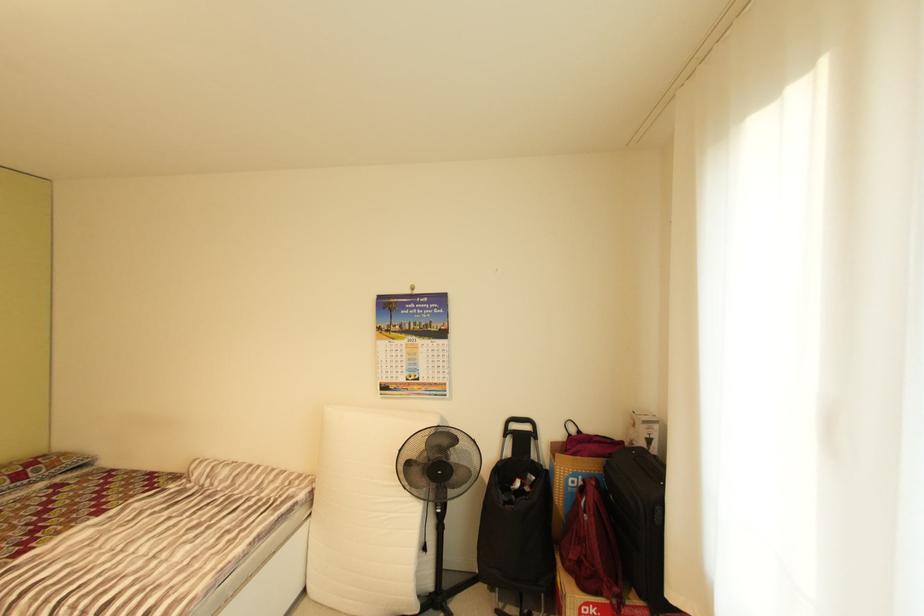
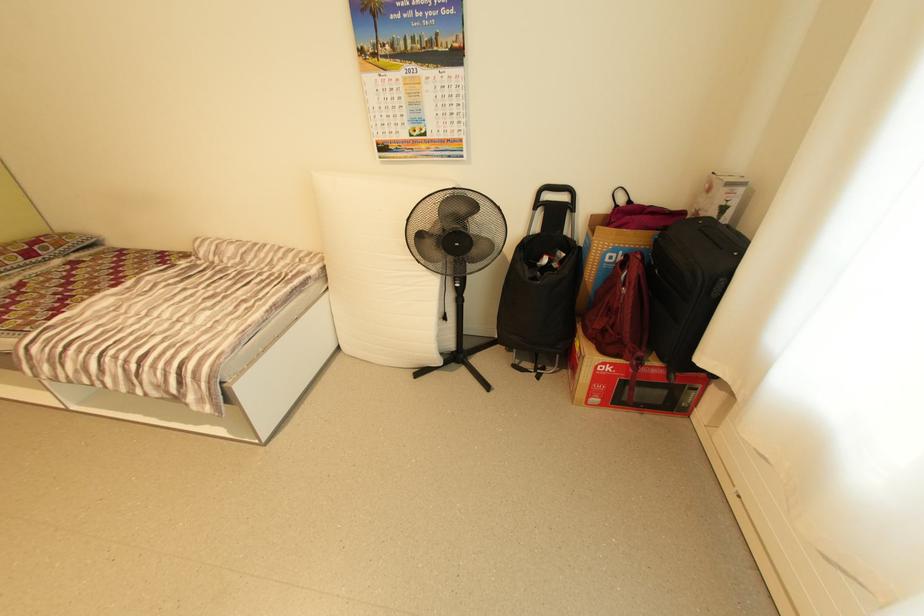
Where in the second image is the point corresponding to (x=641, y=447) from the first image?

(709, 217)